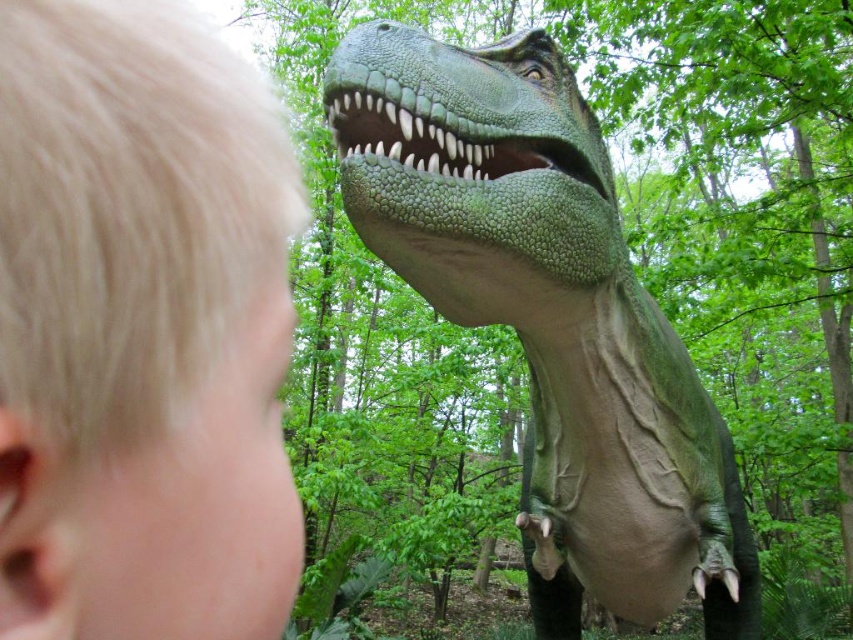
Consider the image. You are standing in the scene facing the same direction as the person in the image. There are two points marked in the image at coordinates point (80, 72) and point (567, 312). Which point is closer to you?

Point (80, 72) is in front of point (567, 312), so it is closer to you.

Looking at this image, you are holding a small flashlight that is 3 inches long. You want to shine it on the point at coordinate point (24, 344) without it being blocked by the dinosaur model. Can you do it?

The point at coordinate point (24, 344) is 11.46 inches away from the viewer. Since the flashlight is only 3 inches long, it cannot reach that distance. Therefore, you cannot shine the flashlight on the point without it being blocked by the dinosaur model.